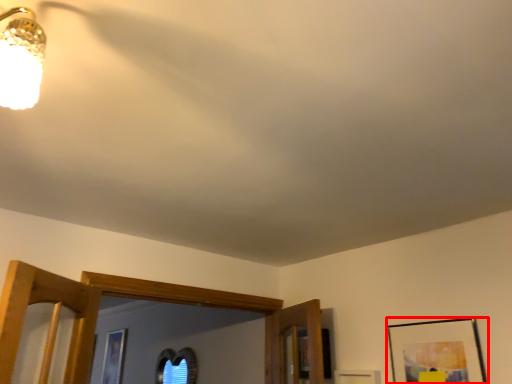
Question: From the image, what is the correct spatial relationship of picture frame (annotated by the red box) in relation to picture?

Choices:
 (A) left
 (B) right

Answer: (B)